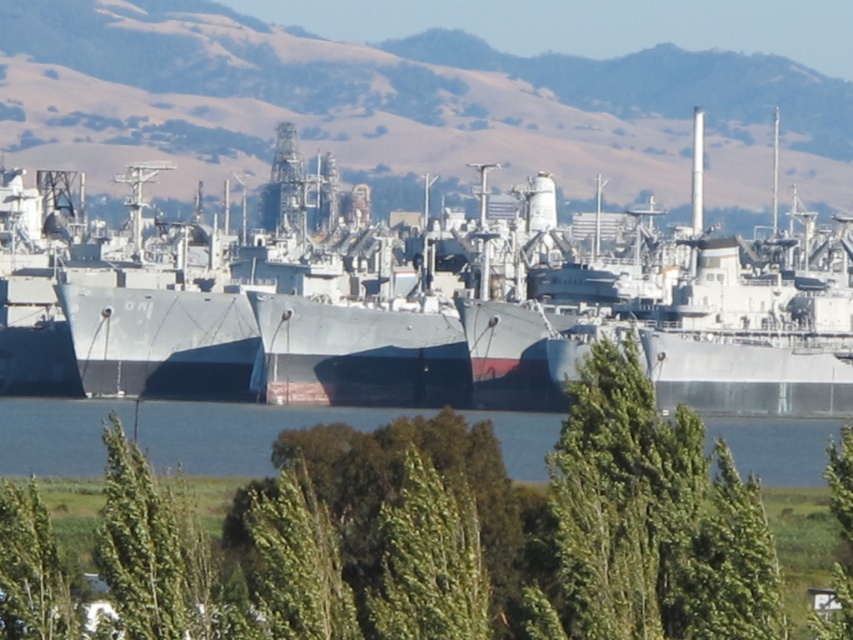
What is located at the point with coordinates [456,532] in the maritime scene?

The point at coordinates [456,532] marks the location of a green leafy tree at center in the maritime scene.

Based on the photo, you are a sailor who needs to locate the green leafy tree at center while standing on the metallic gray ship at center. Which direction should you look to find the tree?

The green leafy tree at center is located below the metallic gray ship at center, so you should look downward from the metallic gray ship at center to find the tree.

You are a naval architect designing a new ship. You need to ensure that your ship will fit within the existing dock space at the shipyard shown. Given that the dock space is designed to accommodate ships up to the width of the blue water at center, will the metallic gray ship at center fit within this space?

The metallic gray ship at center is wider than the blue water at center, so it will not fit within the dock space designed for the blue water at center width.